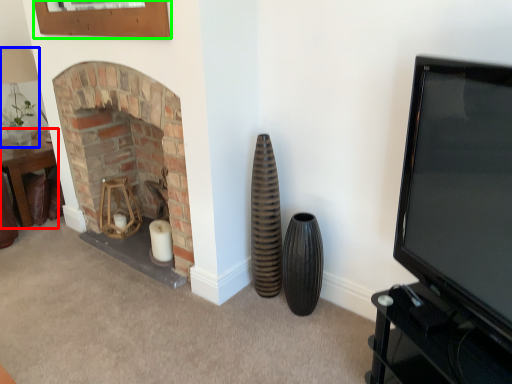
Question: Estimate the real-world distances between objects in this image. Which object is closer to table (highlighted by a red box), lamp (highlighted by a blue box) or picture frame (highlighted by a green box)?

Choices:
 (A) lamp
 (B) picture frame

Answer: (A)